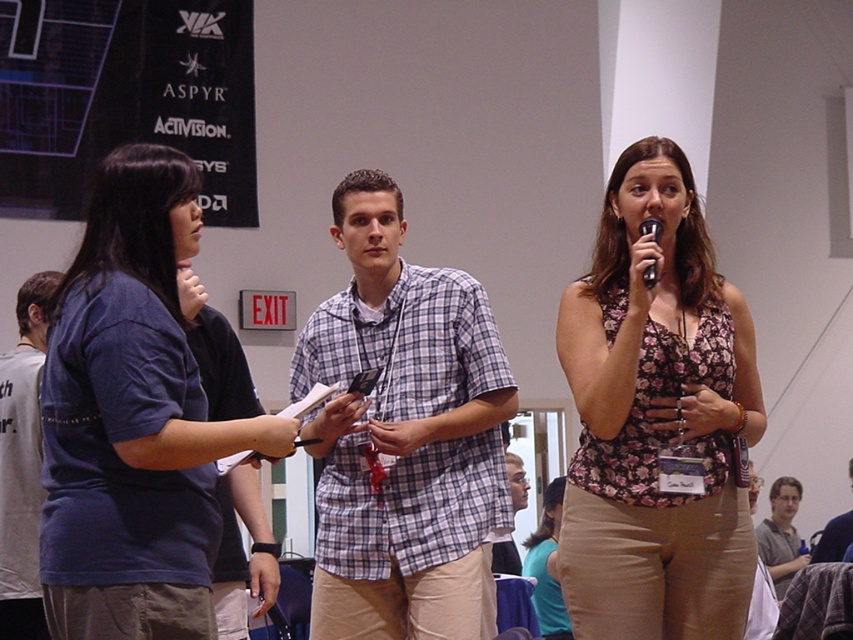
Question: Is teal fabric shirt at center bigger than black plastic microphone at upper right?

Choices:
 (A) no
 (B) yes

Answer: (B)

Question: Which of the following is the closest to the observer?

Choices:
 (A) black plastic microphone at upper right
 (B) matte blue shirt at left

Answer: (B)

Question: Which of the following is the farthest from the observer?

Choices:
 (A) teal fabric shirt at center
 (B) floral fabric top at center
 (C) black plastic microphone at upper right
 (D) blue plaid shirt at center

Answer: (D)

Question: Is matte blue shirt at left to the right of teal fabric shirt at center from the viewer's perspective?

Choices:
 (A) no
 (B) yes

Answer: (A)

Question: Which object is the closest to the white cotton shirt at left?

Choices:
 (A) floral fabric top at center
 (B) matte blue shirt at left
 (C) black plastic microphone at upper right

Answer: (B)

Question: Can you confirm if plaid fabric shirt at center is positioned below black plastic microphone at upper right?

Choices:
 (A) no
 (B) yes

Answer: (B)